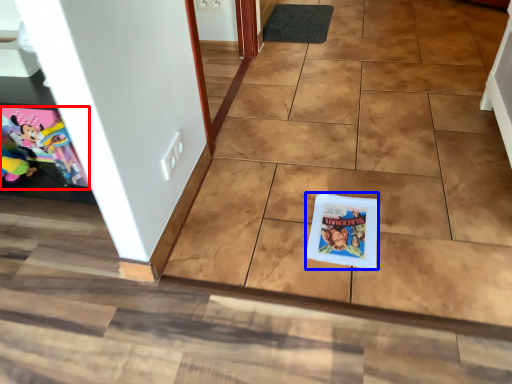
Question: Which of the following is the closest to the observer, comic book (highlighted by a red box) or comic book (highlighted by a blue box)?

Choices:
 (A) comic book
 (B) comic book

Answer: (B)